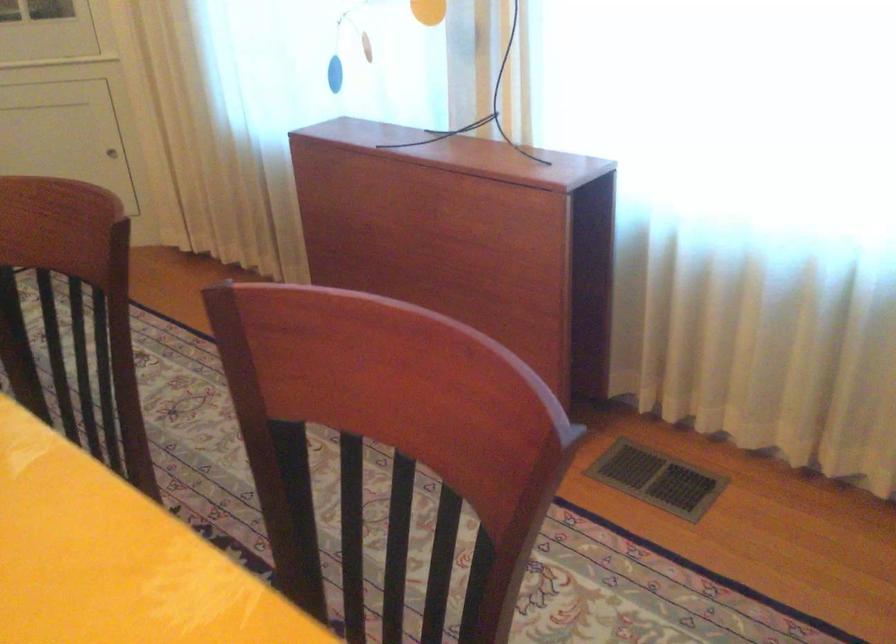
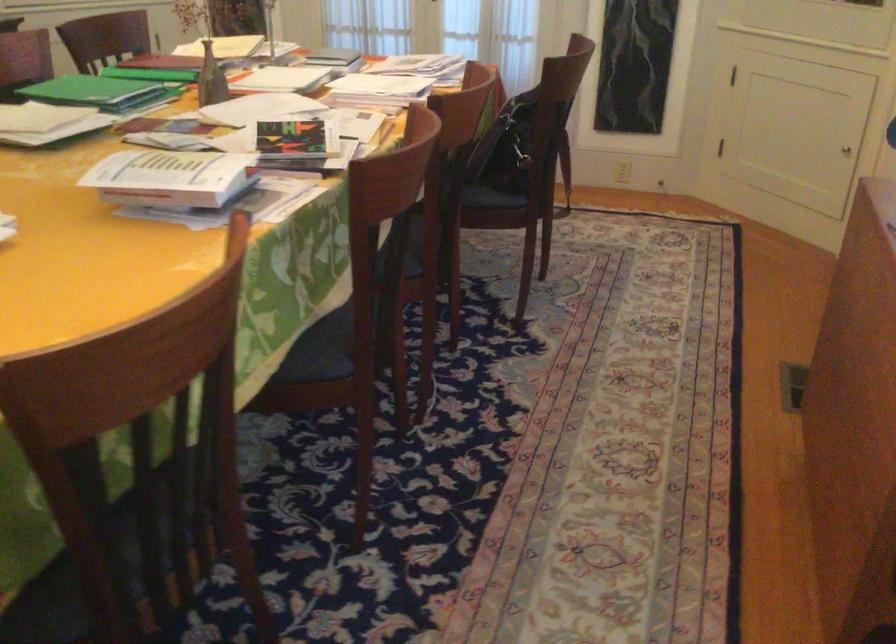
The point at (108, 153) is marked in the first image. Where is the corresponding point in the second image?

(846, 149)